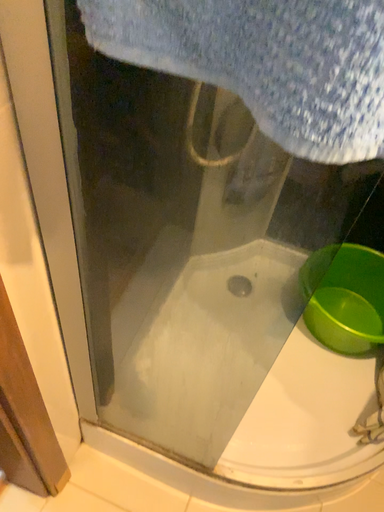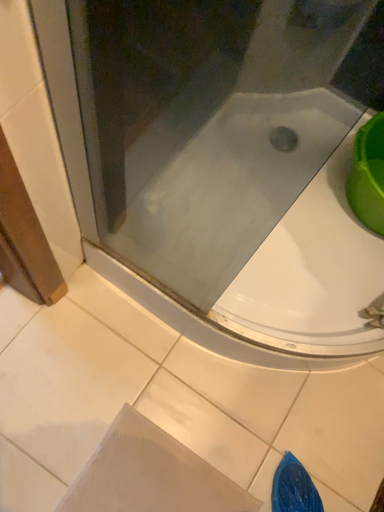
Question: Which way did the camera rotate in the video?

Choices:
 (A) rotated left
 (B) rotated right

Answer: (A)